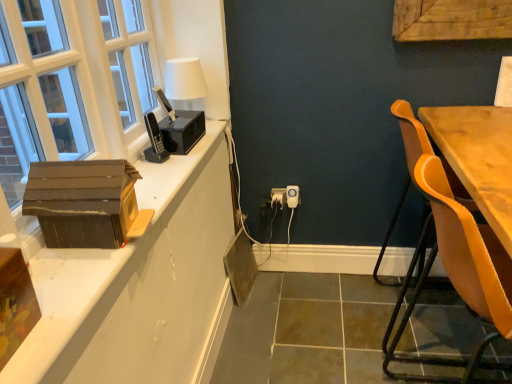
This screenshot has width=512, height=384. In order to click on brown wood cabinetry at left in this screenshot , I will do `click(141, 286)`.

What do you see at coordinates (458, 273) in the screenshot? Image resolution: width=512 pixels, height=384 pixels. I see `leatherette chair at right` at bounding box center [458, 273].

What are the coordinates of `brown wood cabinetry at left` in the screenshot? It's located at (141, 286).

From a real-world perspective, is white matte table lamp at upper left beneath brown cardboard box at lower left, the first cardboard box ordered from the bottom?

No, from a real-world perspective, white matte table lamp at upper left is not under brown cardboard box at lower left, the first cardboard box ordered from the bottom.

From the image's perspective, is white matte table lamp at upper left positioned above or below brown cardboard box at lower left, the first cardboard box ordered from the bottom?

white matte table lamp at upper left is situated higher than brown cardboard box at lower left, the first cardboard box ordered from the bottom, in the image.

Considering the positions of objects white matte table lamp at upper left and brown cardboard box at lower left, which is counted as the second cardboard box, starting from the back, in the image provided, who is in front, white matte table lamp at upper left or brown cardboard box at lower left, which is counted as the second cardboard box, starting from the back,?

brown cardboard box at lower left, which is counted as the second cardboard box, starting from the back, is closer to the camera.

Consider the image. Is white matte table lamp at upper left positioned beyond the bounds of brown cardboard box at lower left, which is counted as the second cardboard box, starting from the back?

Indeed, white matte table lamp at upper left is completely outside brown cardboard box at lower left, which is counted as the second cardboard box, starting from the back.

From a real-world perspective, is brown cardboard box at left, which is counted as the first cardboard box, starting from the top, positioned over white plastic electric outlet at center based on gravity?

Indeed, from a real-world perspective, brown cardboard box at left, which is counted as the first cardboard box, starting from the top, stands above white plastic electric outlet at center.

From the image's perspective, is brown cardboard box at left, the second cardboard box when ordered from bottom to top, positioned above or below white plastic electric outlet at center?

Based on their image positions, brown cardboard box at left, the second cardboard box when ordered from bottom to top, is located above white plastic electric outlet at center.

Is brown cardboard box at left, the second cardboard box in the front-to-back sequence, with white plastic electric outlet at center?

No.

Can you confirm if brown cardboard box at left, which is counted as the first cardboard box, starting from the top, is positioned to the left of white plastic electric outlet at center?

Correct, you'll find brown cardboard box at left, which is counted as the first cardboard box, starting from the top, to the left of white plastic electric outlet at center.

Between white plastic electric outlet at center and leatherette chair at right, which one appears on the left side from the viewer's perspective?

white plastic electric outlet at center is more to the left.

From a real-world perspective, is white plastic electric outlet at center physically below leatherette chair at right?

Yes, from a real-world perspective, white plastic electric outlet at center is under leatherette chair at right.

Which of these two, white plastic electric outlet at center or leatherette chair at right, is bigger?

Bigger between the two is leatherette chair at right.

Considering the relative sizes of leatherette chair at right and brown wood cabinetry at left in the image provided, is leatherette chair at right thinner than brown wood cabinetry at left?

In fact, leatherette chair at right might be wider than brown wood cabinetry at left.

Between point (497, 248) and point (134, 329), which one is positioned in front?

Point (134, 329)

Is leatherette chair at right with brown wood cabinetry at left?

No, leatherette chair at right is not in contact with brown wood cabinetry at left.

From the image's perspective, which is below, leatherette chair at right or brown wood cabinetry at left?

leatherette chair at right.

Does white plastic power outlet at center contain brown cardboard box at left, the second cardboard box in the front-to-back sequence?

No, white plastic power outlet at center does not contain brown cardboard box at left, the second cardboard box in the front-to-back sequence.

In the image, is white plastic power outlet at center on the left side or the right side of brown cardboard box at left, the second cardboard box when ordered from bottom to top?

Answer: From the image, it's evident that white plastic power outlet at center is to the right of brown cardboard box at left, the second cardboard box when ordered from bottom to top.

Considering the sizes of white plastic power outlet at center and brown cardboard box at left, which is counted as the first cardboard box, starting from the top, in the image, is white plastic power outlet at center taller or shorter than brown cardboard box at left, which is counted as the first cardboard box, starting from the top,?

Considering their sizes, white plastic power outlet at center has less height than brown cardboard box at left, which is counted as the first cardboard box, starting from the top.

Could you tell me if white plastic power outlet at center is turned towards brown cardboard box at left, which is counted as the first cardboard box, starting from the top?

No, white plastic power outlet at center is not aimed at brown cardboard box at left, which is counted as the first cardboard box, starting from the top.

Is white plastic power outlet at center bigger or smaller than leatherette chair at right?

Clearly, white plastic power outlet at center is smaller in size than leatherette chair at right.

Is white plastic power outlet at center looking in the opposite direction of leatherette chair at right?

white plastic power outlet at center does not have its back to leatherette chair at right.

From the image's perspective, which is above, white plastic power outlet at center or leatherette chair at right?

white plastic power outlet at center.

Is white plastic power outlet at center at the right side of leatherette chair at right?

In fact, white plastic power outlet at center is to the left of leatherette chair at right.

How different are the orientations of brown cardboard box at lower left, which appears as the second cardboard box when viewed from the top, and white matte table lamp at upper left in degrees?

There is a 1.41-degree angle between the facing directions of brown cardboard box at lower left, which appears as the second cardboard box when viewed from the top, and white matte table lamp at upper left.

Where is `table lamp behind the brown cardboard box at lower left, the first cardboard box ordered from the bottom`? This screenshot has height=384, width=512. table lamp behind the brown cardboard box at lower left, the first cardboard box ordered from the bottom is located at coordinates (181, 110).

Can you confirm if brown cardboard box at lower left, which appears as the second cardboard box when viewed from the top, is wider than white matte table lamp at upper left?

No, brown cardboard box at lower left, which appears as the second cardboard box when viewed from the top, is not wider than white matte table lamp at upper left.

In the scene shown: Considering the sizes of brown cardboard box at lower left, the first cardboard box ordered from the bottom, and white matte table lamp at upper left in the image, is brown cardboard box at lower left, the first cardboard box ordered from the bottom, taller or shorter than white matte table lamp at upper left?

brown cardboard box at lower left, the first cardboard box ordered from the bottom, is shorter than white matte table lamp at upper left.

Locate an element on the screen. The width and height of the screenshot is (512, 384). the 2nd cardboard box positioned below the white matte table lamp at upper left (from the image's perspective) is located at coordinates (15, 303).

Locate an element on the screen. This screenshot has width=512, height=384. the 2nd cardboard box positioned above the white plastic electric outlet at center (from a real-world perspective) is located at coordinates (82, 202).

Based on their spatial positions, is brown cardboard box at lower left, which is counted as the second cardboard box, starting from the back, or white plastic electric outlet at center further from brown cardboard box at left, the second cardboard box in the front-to-back sequence?

white plastic electric outlet at center.

Which object lies nearer to the anchor point brown wood cabinetry at left, brown cardboard box at lower left, which is counted as the second cardboard box, starting from the back, or brown cardboard box at left, the 1th cardboard box positioned from the back?

→ brown cardboard box at left, the 1th cardboard box positioned from the back, is closer to brown wood cabinetry at left.

Considering their positions, is brown wood cabinetry at left positioned further to leatherette chair at right than brown cardboard box at lower left, placed as the 1th cardboard box when sorted from front to back?

brown cardboard box at lower left, placed as the 1th cardboard box when sorted from front to back.

From the picture: Which object lies further to the anchor point white plastic electric outlet at center, brown cardboard box at left, the second cardboard box in the front-to-back sequence, or brown cardboard box at lower left, which appears as the second cardboard box when viewed from the top?

Based on the image, brown cardboard box at lower left, which appears as the second cardboard box when viewed from the top, appears to be further to white plastic electric outlet at center.

Estimate the real-world distances between objects in this image. Which object is closer to white plastic electric outlet at center, brown wood cabinetry at left or brown cardboard box at lower left, which appears as the second cardboard box when viewed from the top?

brown wood cabinetry at left lies closer to white plastic electric outlet at center than the other object.

Considering their positions, is brown wood cabinetry at left positioned closer to white plastic electric outlet at center than white plastic power outlet at center?

The object closer to white plastic electric outlet at center is white plastic power outlet at center.

In the scene shown: Estimate the real-world distances between objects in this image. Which object is closer to white plastic power outlet at center, leatherette chair at right or white matte table lamp at upper left?

white matte table lamp at upper left lies closer to white plastic power outlet at center than the other object.

From the image, which object appears to be nearer to white plastic electric outlet at center, leatherette chair at right or brown wood cabinetry at left?

brown wood cabinetry at left is positioned closer to the anchor white plastic electric outlet at center.

Locate an element on the screen. cardboard box between brown cardboard box at lower left, the first cardboard box ordered from the bottom, and leatherette chair at right from left to right is located at coordinates (82, 202).

Identify the location of cardboard box between leatherette chair at right and white plastic power outlet at center from front to back. (82, 202).

You are a GUI agent. You are given a task and a screenshot of the screen. Output one action in this format:
    pyautogui.click(x=<x>, y=<y>)
    Task: Click on the chair between brown wood cabinetry at left and white plastic electric outlet at center from front to back
    The image size is (512, 384).
    Given the screenshot: What is the action you would take?
    pyautogui.click(x=458, y=273)

Locate an element on the screen. This screenshot has width=512, height=384. chair between brown cardboard box at lower left, placed as the 1th cardboard box when sorted from front to back, and white matte table lamp at upper left in the front-back direction is located at coordinates (458, 273).